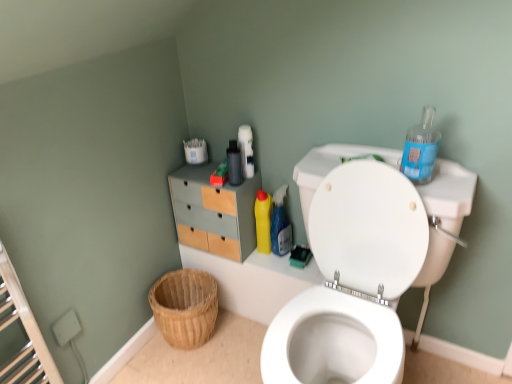
Locate an element on the screen. Image resolution: width=512 pixels, height=384 pixels. free spot in front of yellow plastic bottle at upper right, arranged as the second cleaning product when viewed from the left is located at coordinates click(x=290, y=269).